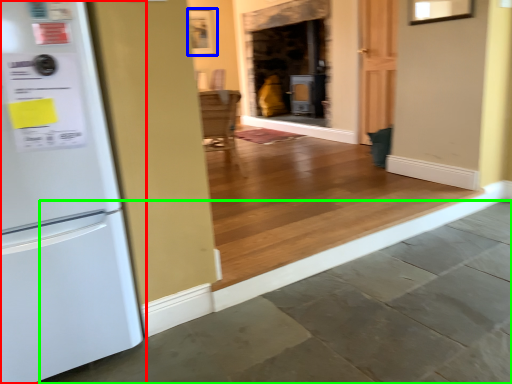
Question: Which object is the closest to the refrigerator (highlighted by a red box)? Choose among these: picture frame (highlighted by a blue box) or concrete (highlighted by a green box).

Choices:
 (A) picture frame
 (B) concrete

Answer: (B)